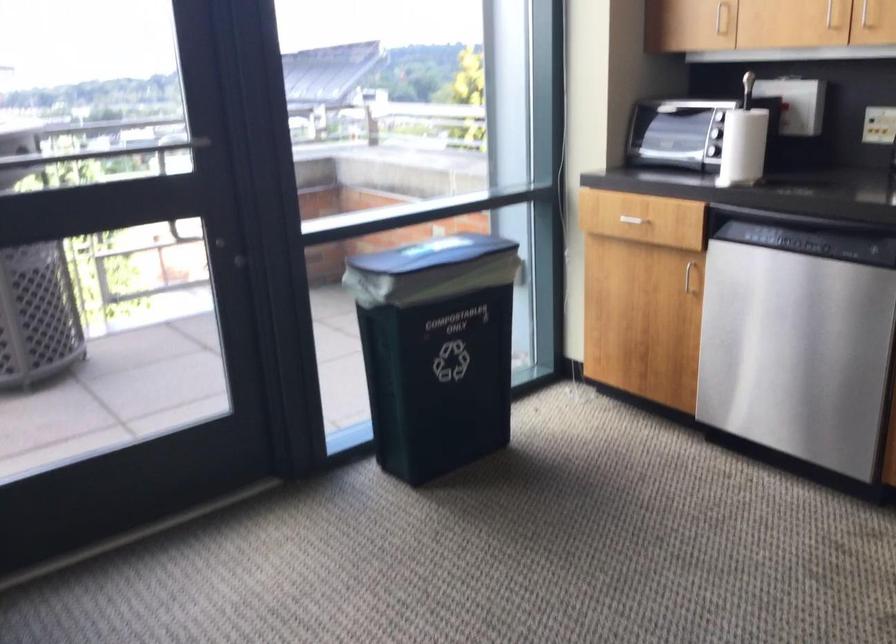
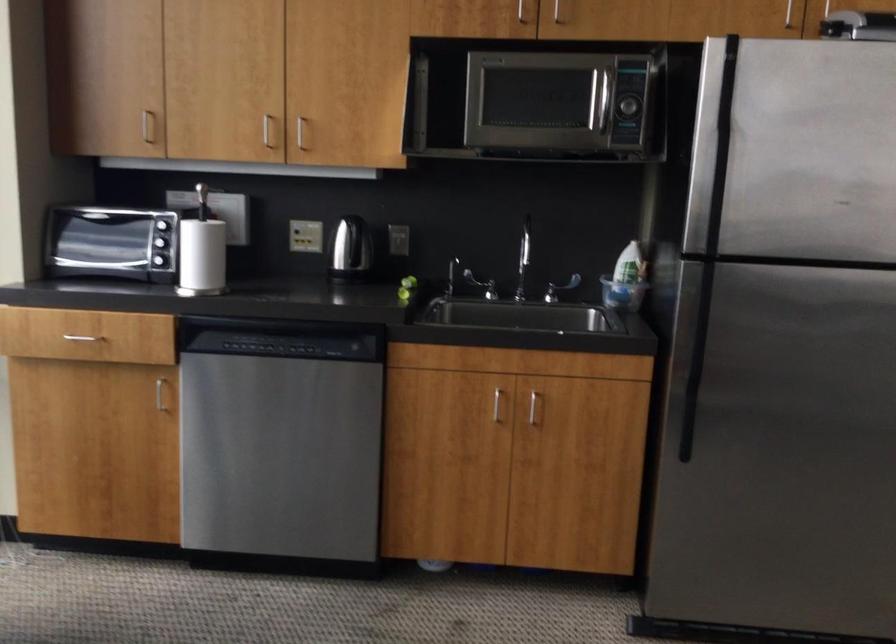
Find the pixel in the second image that matches (795,243) in the first image.

(277, 346)